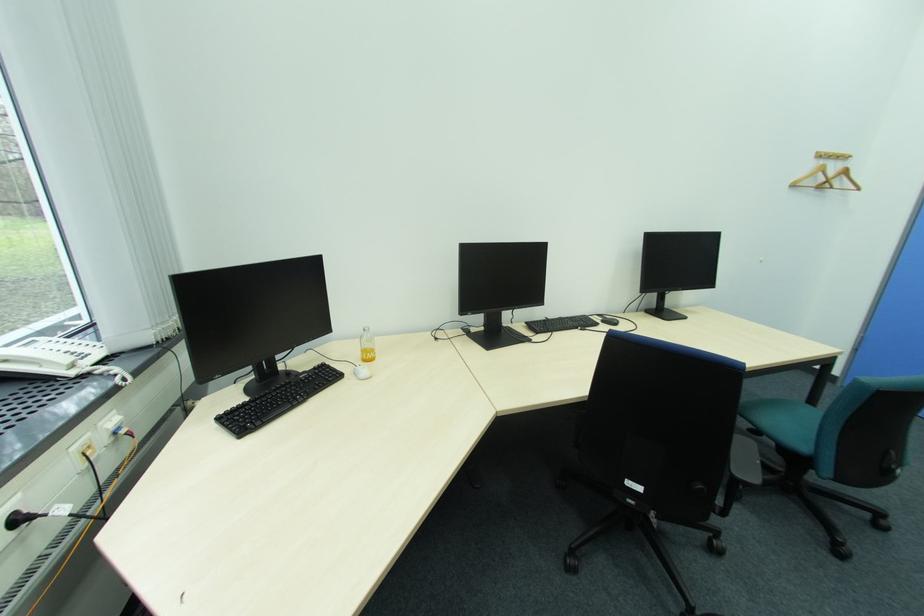
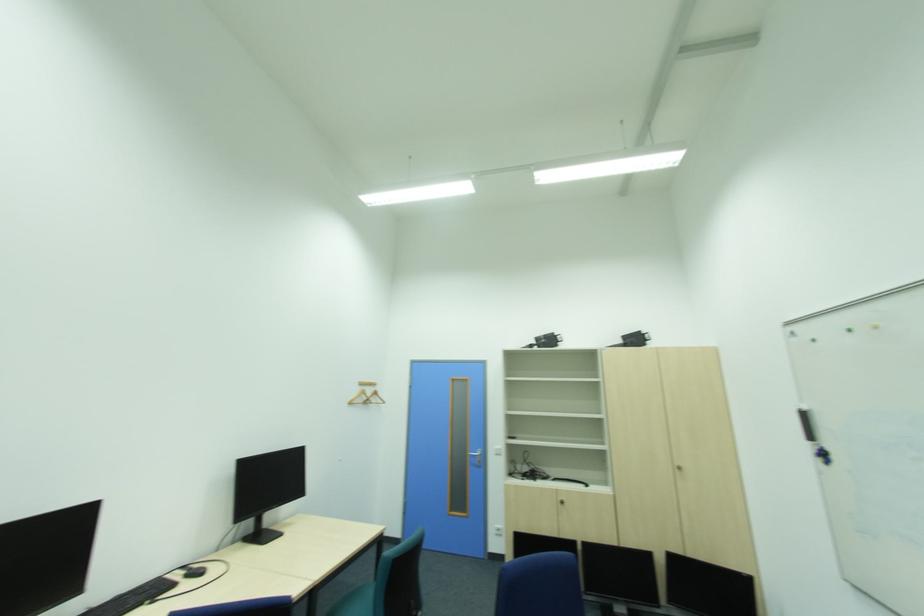
First-person continuous shooting, in which direction is the camera rotating?

The camera's rotation is toward right-up.